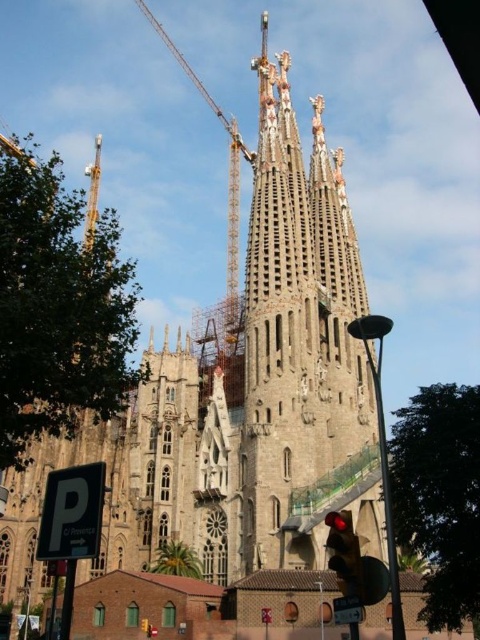
You are a tourist standing on the street in front of the Sagrada Familia. You see the gray stone tower at center and the red glass traffic light at lower center. Which object is closer to you?

The gray stone tower at center is closer to you than the red glass traffic light at lower center because it is further to the viewer.

You are a tourist standing on the street in front of the Sagrada Familia. You see the gray stone tower at center and the metallic construction crane at upper center. Which object is closer to you?

The gray stone tower at center is closer to you because it is in front of the metallic construction crane at upper center.

You are standing at the Sagrada Familia and want to take a photo of the gray stone tower at center. You notice a point marked at coordinates (300,340). Where is this point located on the tower?

The point marked at coordinates (300,340) is located on the gray stone tower at center.